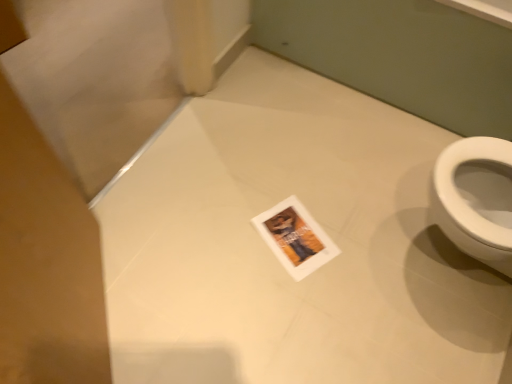
The image size is (512, 384). Identify the location of free space to the left of white paper postcard at center. (227, 233).